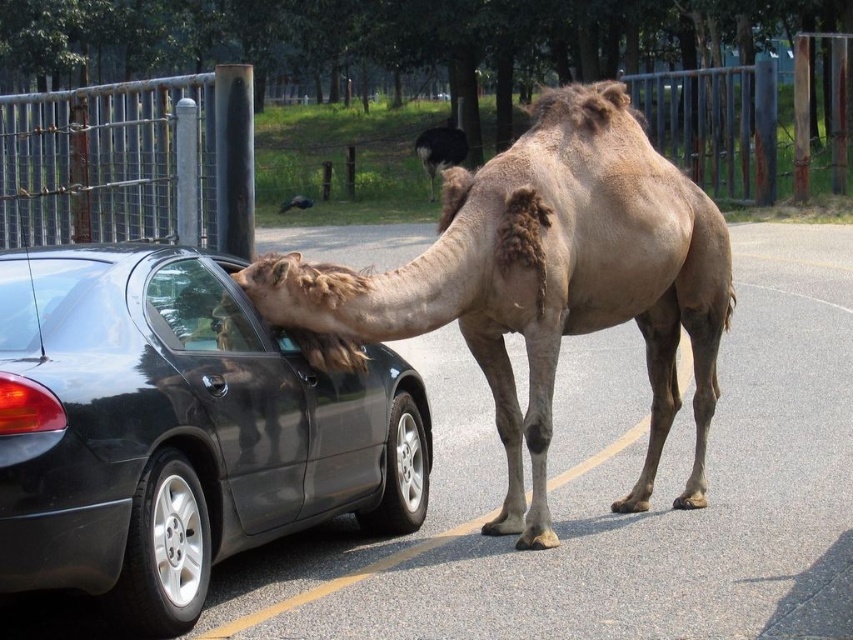
How distant is satin black car at left from fuzzy brown camel at center?

satin black car at left is 86.75 feet away from fuzzy brown camel at center.

Is satin black car at left positioned before fuzzy brown camel at center?

Yes, it is.

Which is in front, point (180, 584) or point (451, 161)?

Positioned in front is point (180, 584).

Find the location of `satin black car at left`. satin black car at left is located at coordinates (178, 429).

Is light brown fur camel at center below fuzzy brown camel at center?

Yes, light brown fur camel at center is below fuzzy brown camel at center.

Can you confirm if light brown fur camel at center is smaller than fuzzy brown camel at center?

Yes.

The image size is (853, 640). I want to click on light brown fur camel at center, so click(x=543, y=282).

Can you confirm if satin black car at left is wider than light brown fur camel at center?

Indeed, satin black car at left has a greater width compared to light brown fur camel at center.

Between point (277, 381) and point (547, 99), which one is positioned in front?

Positioned in front is point (277, 381).

Does point (265, 417) come closer to viewer compared to point (274, 294)?

Yes, point (265, 417) is closer to viewer.

What are the coordinates of `satin black car at left` in the screenshot? It's located at (178, 429).